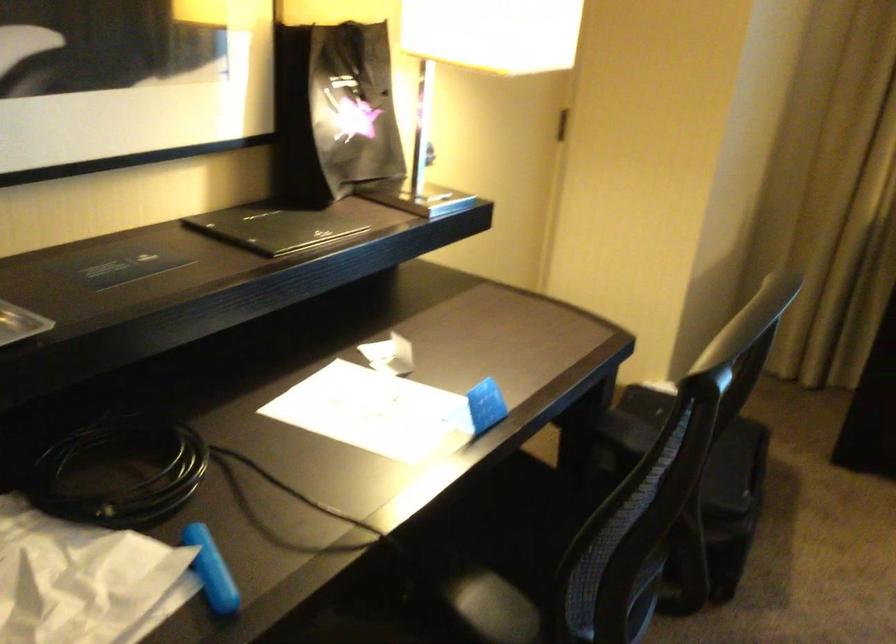
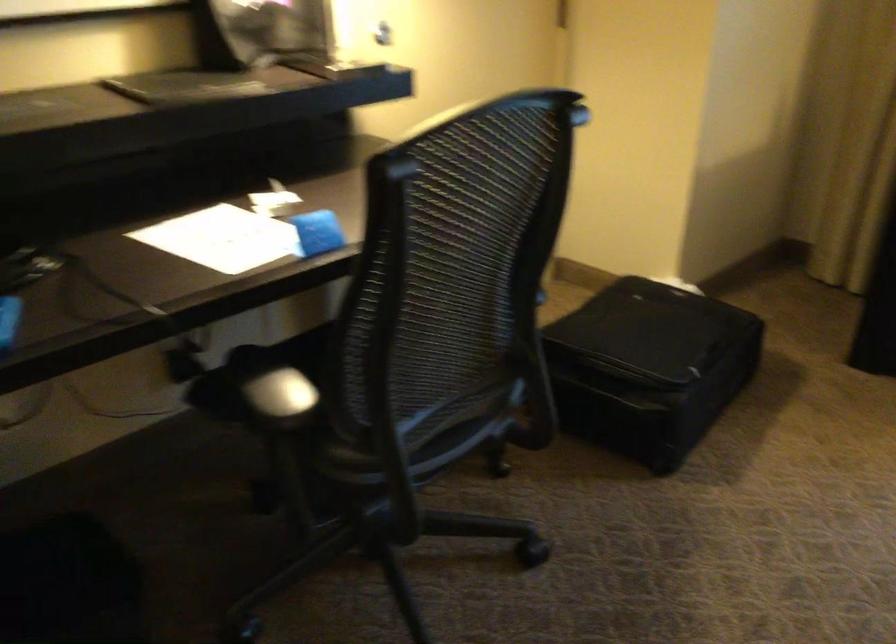
Where in the second image is the point corresponding to (x=457, y=573) from the first image?

(259, 371)